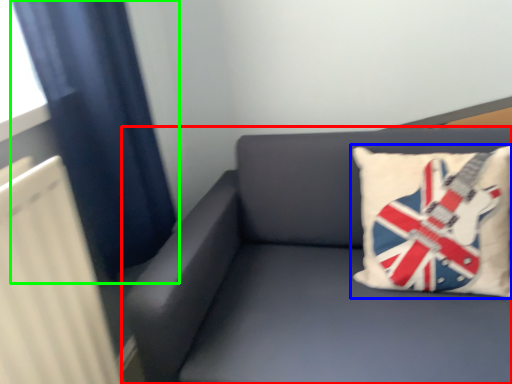
Question: Which object is positioned farthest from studio couch (highlighted by a red box)? Select from pillow (highlighted by a blue box) and curtain (highlighted by a green box).

Choices:
 (A) pillow
 (B) curtain

Answer: (B)